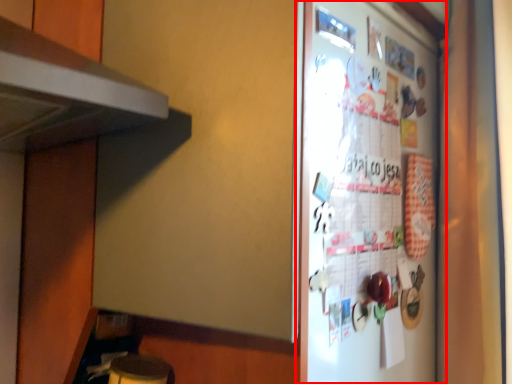
Question: Considering the relative positions of refrigerator (annotated by the red box) and curtain in the image provided, where is refrigerator (annotated by the red box) located with respect to the staircase?

Choices:
 (A) left
 (B) right

Answer: (A)